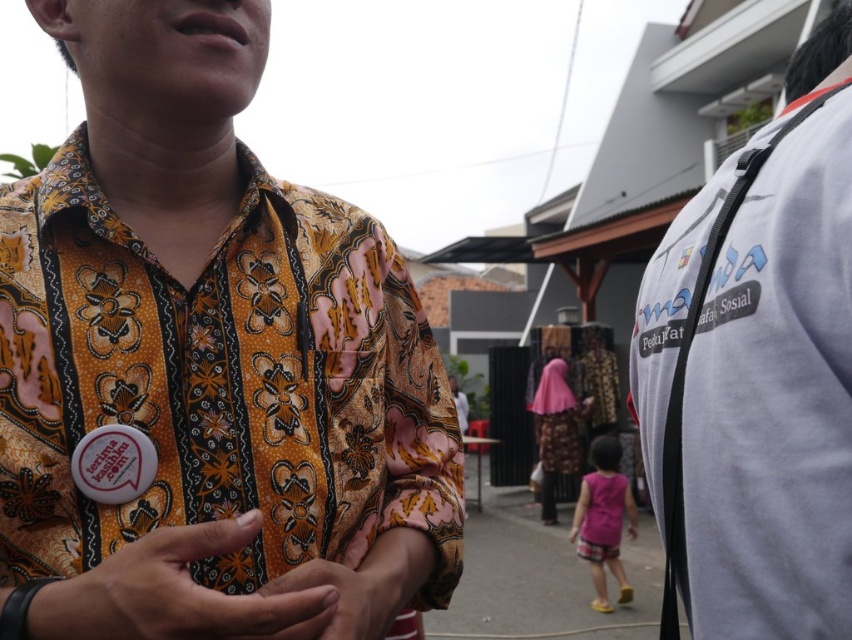
Question: Where is matte fabric hand at center located in relation to matte floral shirt at center in the image?

Choices:
 (A) right
 (B) left

Answer: (B)

Question: Can you confirm if batik shirt at center is positioned above matte floral shirt at center?

Choices:
 (A) yes
 (B) no

Answer: (A)

Question: Observing the image, what is the correct spatial positioning of pink fabric dress at lower center in reference to matte floral shirt at center?

Choices:
 (A) left
 (B) right

Answer: (B)

Question: Which object is positioned farthest from the batik shirt at center?

Choices:
 (A) pink fabric dress at lower center
 (B) white fabric shirt at right
 (C) matte floral shirt at center

Answer: (A)

Question: Which object appears farthest from the camera in this image?

Choices:
 (A) matte floral shirt at center
 (B) matte fabric hand at center

Answer: (A)

Question: Which point is farther to the camera?

Choices:
 (A) (296, 621)
 (B) (822, 177)
 (C) (204, 342)

Answer: (C)